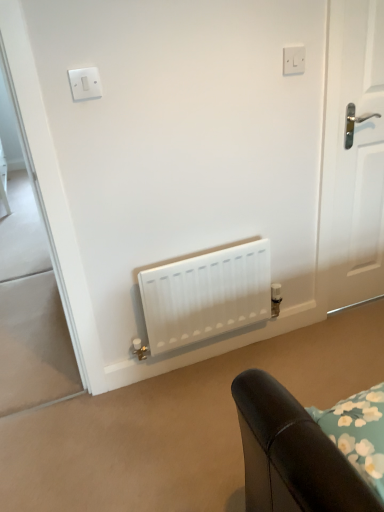
Question: Are white matte radiator at center and white plastic switch at upper center beside each other?

Choices:
 (A) no
 (B) yes

Answer: (A)

Question: Does white matte radiator at center lie behind white plastic switch at upper center?

Choices:
 (A) no
 (B) yes

Answer: (B)

Question: Is white matte radiator at center shorter than white plastic switch at upper center?

Choices:
 (A) no
 (B) yes

Answer: (A)

Question: Is white matte radiator at center positioned beyond the bounds of white plastic switch at upper center?

Choices:
 (A) no
 (B) yes

Answer: (B)

Question: Is white plastic switch at upper center at the back of white matte radiator at center?

Choices:
 (A) yes
 (B) no

Answer: (B)

Question: Is white plastic light switch at upper left inside the boundaries of white plastic switch at upper center, or outside?

Choices:
 (A) outside
 (B) inside

Answer: (A)

Question: In terms of width, does white plastic light switch at upper left look wider or thinner when compared to white plastic switch at upper center?

Choices:
 (A) thin
 (B) wide

Answer: (B)

Question: Looking at the image, does white plastic light switch at upper left seem bigger or smaller compared to white plastic switch at upper center?

Choices:
 (A) small
 (B) big

Answer: (B)

Question: Is point (74, 91) positioned closer to the camera than point (299, 50)?

Choices:
 (A) farther
 (B) closer

Answer: (B)

Question: From a real-world perspective, relative to white plastic light switch at upper left, is white matte radiator at center vertically above or below?

Choices:
 (A) above
 (B) below

Answer: (B)

Question: In terms of width, does white matte radiator at center look wider or thinner when compared to white plastic light switch at upper left?

Choices:
 (A) wide
 (B) thin

Answer: (A)

Question: From the image's perspective, is white matte radiator at center located above or below white plastic light switch at upper left?

Choices:
 (A) above
 (B) below

Answer: (B)

Question: Do you think white matte radiator at center is within white plastic light switch at upper left, or outside of it?

Choices:
 (A) inside
 (B) outside

Answer: (B)

Question: Considering the positions of point (175, 326) and point (301, 64), is point (175, 326) closer or farther from the camera than point (301, 64)?

Choices:
 (A) farther
 (B) closer

Answer: (A)

Question: Which is correct: white matte radiator at center is inside white plastic switch at upper center, or outside of it?

Choices:
 (A) outside
 (B) inside

Answer: (A)